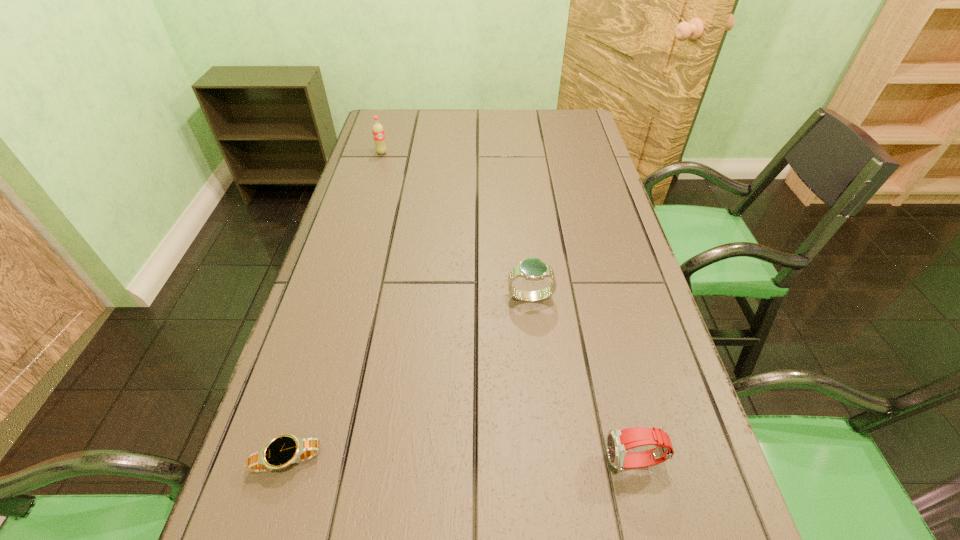
The width and height of the screenshot is (960, 540). In order to click on free region located 0.180m on the face of the rightmost watch in this screenshot , I will do `click(501, 462)`.

Locate an element on the screen. Image resolution: width=960 pixels, height=540 pixels. vacant point located on the face of the rightmost watch is located at coordinates (536, 462).

At what (x,y) coordinates should I click in order to perform the action: click on vacant area situated 0.370m on the right of the leftmost watch. Please return your answer as a coordinate pair (x, y). The height and width of the screenshot is (540, 960). Looking at the image, I should click on (536, 460).

Locate an element on the screen. This screenshot has width=960, height=540. soda that is at the left edge is located at coordinates (378, 131).

This screenshot has width=960, height=540. What are the coordinates of `watch located at the left edge` in the screenshot? It's located at (284, 450).

The width and height of the screenshot is (960, 540). In order to click on object positioned at the right edge in this screenshot , I will do `click(619, 441)`.

This screenshot has height=540, width=960. In the image, there is a desktop. Find the location of `vacant space at the left edge`. vacant space at the left edge is located at coordinates (371, 158).

At what (x,y) coordinates should I click in order to perform the action: click on vacant space at the right edge of the desktop. Please return your answer as a coordinate pair (x, y). This screenshot has height=540, width=960. Looking at the image, I should click on (647, 416).

The width and height of the screenshot is (960, 540). In order to click on free space at the far left corner of the desktop in this screenshot , I will do `click(379, 116)`.

Where is `unoccupied area between the farthest object and the shortest object`? Image resolution: width=960 pixels, height=540 pixels. unoccupied area between the farthest object and the shortest object is located at coordinates (335, 306).